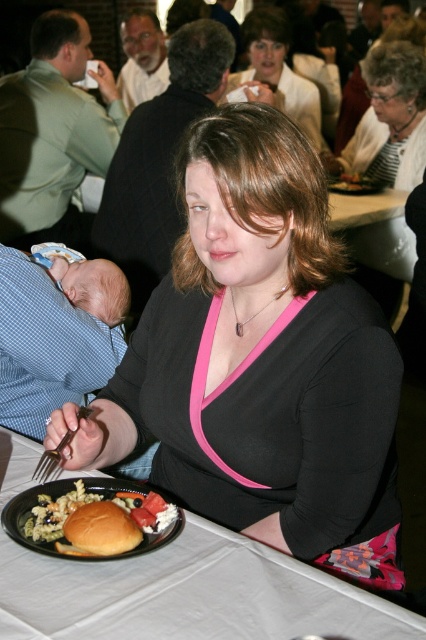
You are at a dinner event and see the green matte shirt at left and the matte plastic fork at upper center. Which object is closer to you?

The green matte shirt at left is closer to you because it is positioned over the matte plastic fork at upper center.